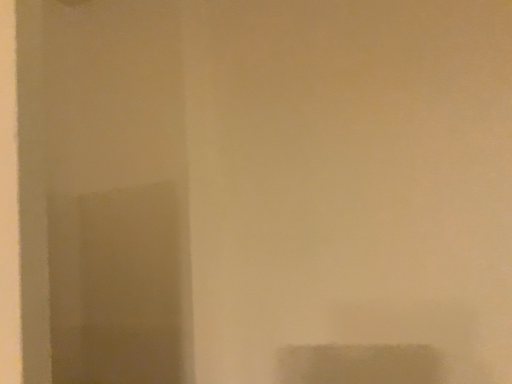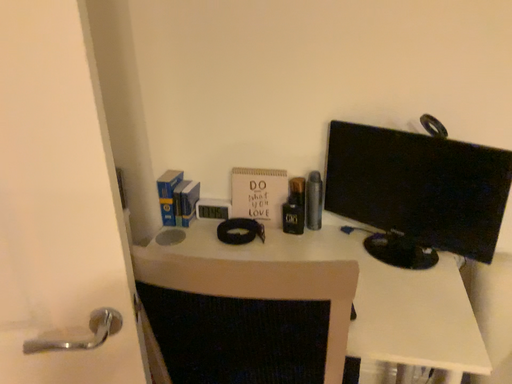
Question: How did the camera likely rotate when shooting the video?

Choices:
 (A) rotated left
 (B) rotated right

Answer: (B)